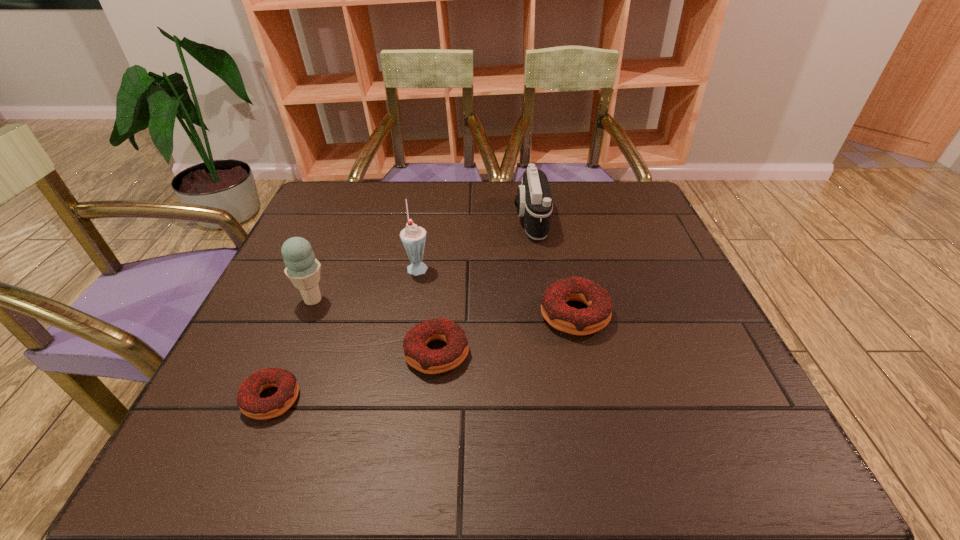
Image resolution: width=960 pixels, height=540 pixels. I want to click on the shortest doughnut, so click(x=248, y=400).

Locate an element on the screen. the leftmost doughnut is located at coordinates (248, 400).

Where is `the second doughnut from right to left`? The image size is (960, 540). the second doughnut from right to left is located at coordinates (430, 361).

The image size is (960, 540). In order to click on the second shortest object in this screenshot , I will do point(430,361).

The image size is (960, 540). I want to click on the fourth tallest object, so click(x=554, y=309).

At what (x,y) coordinates should I click in order to perform the action: click on the rightmost doughnut. Please return your answer as a coordinate pair (x, y). This screenshot has height=540, width=960. Looking at the image, I should click on (554, 309).

Where is `the farthest object`? The image size is (960, 540). the farthest object is located at coordinates (534, 203).

The height and width of the screenshot is (540, 960). Identify the location of the fourth shortest object. (534, 203).

This screenshot has width=960, height=540. I want to click on ice cream, so click(302, 268).

Identify the location of milkshake. Image resolution: width=960 pixels, height=540 pixels. (413, 237).